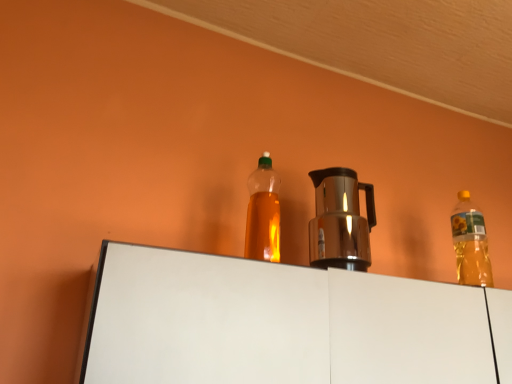
How much space does translucent plastic bottle at upper right, the 2th bottle when ordered from left to right, occupy horizontally?

3.73 inches.

Measure the distance between point (262, 220) and camera.

1.17 meters.

The width and height of the screenshot is (512, 384). What do you see at coordinates (263, 213) in the screenshot? I see `translucent plastic bottle at center, the first bottle from the left` at bounding box center [263, 213].

Find the location of a particular element. Image resolution: width=512 pixels, height=384 pixels. translucent plastic bottle at upper right, the 1th bottle from the back is located at coordinates (470, 243).

Can you confirm if translucent plastic bottle at center, the first bottle from the left, is taller than shiny metallic coffee pot at center?

Indeed, translucent plastic bottle at center, the first bottle from the left, has a greater height compared to shiny metallic coffee pot at center.

Which is more distant, (269, 233) or (354, 210)?

The point (354, 210) is farther.

Considering the sizes of objects translucent plastic bottle at center, the first bottle from the left, and shiny metallic coffee pot at center in the image provided, who is thinner, translucent plastic bottle at center, the first bottle from the left, or shiny metallic coffee pot at center?

Thinner between the two is translucent plastic bottle at center, the first bottle from the left.

How distant is translucent plastic bottle at center, the second bottle when ordered from right to left, from shiny metallic coffee pot at center?

translucent plastic bottle at center, the second bottle when ordered from right to left, is 6.67 inches away from shiny metallic coffee pot at center.

The image size is (512, 384). Find the location of `coffeepot located below the translucent plastic bottle at center, the second bottle when ordered from right to left (from the image's perspective)`. coffeepot located below the translucent plastic bottle at center, the second bottle when ordered from right to left (from the image's perspective) is located at coordinates (340, 220).

Is shiny metallic coffee pot at center located outside translucent plastic bottle at center, the second bottle when ordered from right to left?

That's correct, shiny metallic coffee pot at center is outside of translucent plastic bottle at center, the second bottle when ordered from right to left.

Based on the photo, which object is positioned more to the right, shiny metallic coffee pot at center or translucent plastic bottle at center, the 1th bottle when ordered from front to back?

Positioned to the right is shiny metallic coffee pot at center.

Based on their positions, is translucent plastic bottle at upper right, the 2th bottle when ordered from left to right, located to the left or right of translucent plastic bottle at center, the first bottle from the left?

From the image, it's evident that translucent plastic bottle at upper right, the 2th bottle when ordered from left to right, is to the right of translucent plastic bottle at center, the first bottle from the left.

Does translucent plastic bottle at upper right, the 2th bottle viewed from the front, contain translucent plastic bottle at center, the second bottle when ordered from right to left?

No, translucent plastic bottle at center, the second bottle when ordered from right to left, is located outside of translucent plastic bottle at upper right, the 2th bottle viewed from the front.

From the picture: From a real-world perspective, is translucent plastic bottle at upper right, the first bottle when ordered from right to left, positioned above or below translucent plastic bottle at center, which is the 2th bottle from back to front?

In terms of real-world spatial position, translucent plastic bottle at upper right, the first bottle when ordered from right to left, is above translucent plastic bottle at center, which is the 2th bottle from back to front.

Would you consider translucent plastic bottle at upper right, the first bottle when ordered from right to left, to be distant from translucent plastic bottle at center, the 1th bottle when ordered from front to back?

No, translucent plastic bottle at upper right, the first bottle when ordered from right to left, is not far away from translucent plastic bottle at center, the 1th bottle when ordered from front to back.

Who is taller, shiny metallic coffee pot at center or translucent plastic bottle at upper right, the 2th bottle viewed from the front?

Standing taller between the two is translucent plastic bottle at upper right, the 2th bottle viewed from the front.

Is shiny metallic coffee pot at center turned away from translucent plastic bottle at upper right, the 1th bottle from the back?

shiny metallic coffee pot at center does not have its back to translucent plastic bottle at upper right, the 1th bottle from the back.

Which object is closer to the camera, shiny metallic coffee pot at center or translucent plastic bottle at upper right, the 2th bottle viewed from the front?

Positioned in front is shiny metallic coffee pot at center.

From the image's perspective, does shiny metallic coffee pot at center appear lower than translucent plastic bottle at upper right, the first bottle when ordered from right to left?

No.

Who is taller, translucent plastic bottle at upper right, the 2th bottle when ordered from left to right, or shiny metallic coffee pot at center?

Standing taller between the two is translucent plastic bottle at upper right, the 2th bottle when ordered from left to right.

Is translucent plastic bottle at upper right, the 1th bottle from the back, not close to shiny metallic coffee pot at center?

translucent plastic bottle at upper right, the 1th bottle from the back, is actually quite close to shiny metallic coffee pot at center.

Is translucent plastic bottle at upper right, the 2th bottle when ordered from left to right, facing away from shiny metallic coffee pot at center?

No, translucent plastic bottle at upper right, the 2th bottle when ordered from left to right, is not facing away from shiny metallic coffee pot at center.

From a real-world perspective, which is physically above, translucent plastic bottle at upper right, the 2th bottle viewed from the front, or shiny metallic coffee pot at center?

translucent plastic bottle at upper right, the 2th bottle viewed from the front, from a real-world perspective.

The width and height of the screenshot is (512, 384). I want to click on bottle behind the translucent plastic bottle at center, the second bottle when ordered from right to left, so click(x=470, y=243).

Based on the photo, can you tell me how much translucent plastic bottle at center, the first bottle from the left, and translucent plastic bottle at upper right, the 2th bottle viewed from the front, differ in facing direction?

They differ by 0.303 degrees in their facing directions.

Is translucent plastic bottle at center, the second bottle when ordered from right to left, further to the viewer compared to translucent plastic bottle at upper right, the 2th bottle viewed from the front?

No, translucent plastic bottle at center, the second bottle when ordered from right to left, is closer to the camera.

From a real-world perspective, is translucent plastic bottle at center, the second bottle when ordered from right to left, physically below translucent plastic bottle at upper right, the 2th bottle viewed from the front?

Indeed, from a real-world perspective, translucent plastic bottle at center, the second bottle when ordered from right to left, is positioned beneath translucent plastic bottle at upper right, the 2th bottle viewed from the front.

You are a GUI agent. You are given a task and a screenshot of the screen. Output one action in this format:
    pyautogui.click(x=<x>, y=<y>)
    Task: Click on the coffeepot behind the translucent plastic bottle at center, which is the 2th bottle from back to front
    The image size is (512, 384).
    Given the screenshot: What is the action you would take?
    pyautogui.click(x=340, y=220)

Identify the location of bottle on the left of shiny metallic coffee pot at center. The image size is (512, 384). (263, 213).

Estimate the real-world distances between objects in this image. Which object is closer to translucent plastic bottle at center, the second bottle when ordered from right to left, shiny metallic coffee pot at center or translucent plastic bottle at upper right, the 2th bottle when ordered from left to right?

Among the two, shiny metallic coffee pot at center is located nearer to translucent plastic bottle at center, the second bottle when ordered from right to left.

Considering their positions, is translucent plastic bottle at upper right, the 2th bottle when ordered from left to right, positioned closer to translucent plastic bottle at center, the first bottle from the left, than shiny metallic coffee pot at center?

shiny metallic coffee pot at center is closer to translucent plastic bottle at center, the first bottle from the left.

From the image, which object appears to be nearer to translucent plastic bottle at upper right, the 2th bottle viewed from the front, shiny metallic coffee pot at center or translucent plastic bottle at center, which is the 2th bottle from back to front?

shiny metallic coffee pot at center.

Based on their spatial positions, is translucent plastic bottle at center, the first bottle from the left, or translucent plastic bottle at upper right, the first bottle when ordered from right to left, closer to shiny metallic coffee pot at center?

The object closer to shiny metallic coffee pot at center is translucent plastic bottle at center, the first bottle from the left.

Which object lies nearer to the anchor point shiny metallic coffee pot at center, translucent plastic bottle at upper right, the first bottle when ordered from right to left, or translucent plastic bottle at center, the 1th bottle when ordered from front to back?

The object closer to shiny metallic coffee pot at center is translucent plastic bottle at center, the 1th bottle when ordered from front to back.

Which object lies nearer to the anchor point translucent plastic bottle at upper right, the 2th bottle when ordered from left to right, translucent plastic bottle at center, the first bottle from the left, or shiny metallic coffee pot at center?

shiny metallic coffee pot at center is closer to translucent plastic bottle at upper right, the 2th bottle when ordered from left to right.

Where is `coffeepot between translucent plastic bottle at center, the 1th bottle when ordered from front to back, and translucent plastic bottle at upper right, the 2th bottle viewed from the front`? This screenshot has width=512, height=384. coffeepot between translucent plastic bottle at center, the 1th bottle when ordered from front to back, and translucent plastic bottle at upper right, the 2th bottle viewed from the front is located at coordinates (340, 220).